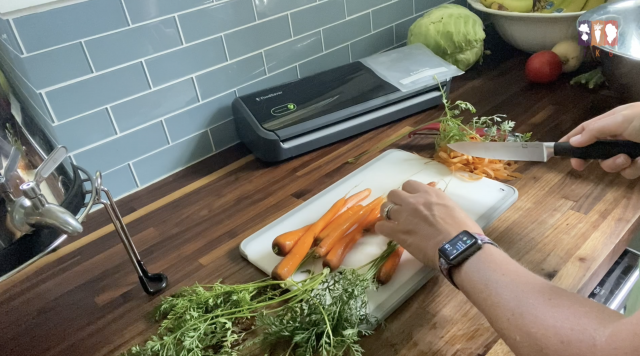
I want to click on white grout, so click(150, 88).